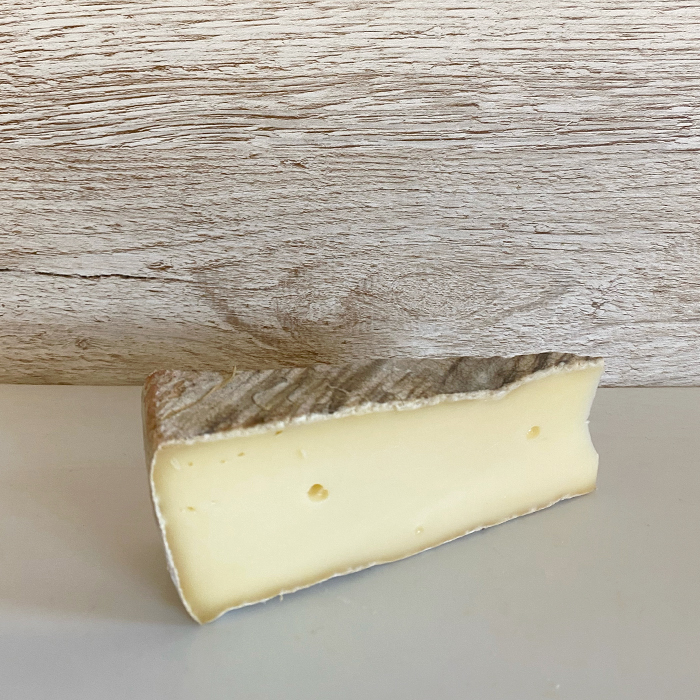
Find the location of a particular element. The height and width of the screenshot is (700, 700). light wood is located at coordinates (295, 10).